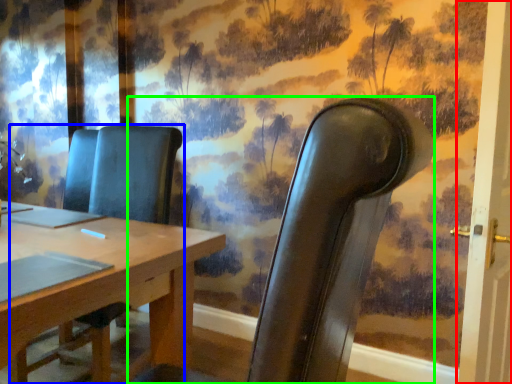
Question: Which object is the closest to the door (highlighted by a red box)? Choose among these: chair (highlighted by a blue box) or chair (highlighted by a green box).

Choices:
 (A) chair
 (B) chair

Answer: (B)